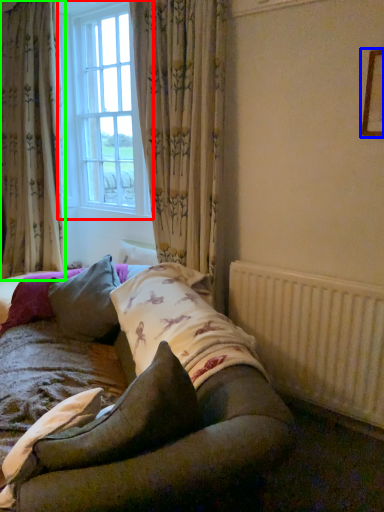
Question: Estimate the real-world distances between objects in this image. Which object is closer to window (highlighted by a red box), picture frame (highlighted by a blue box) or curtain (highlighted by a green box)?

Choices:
 (A) picture frame
 (B) curtain

Answer: (B)